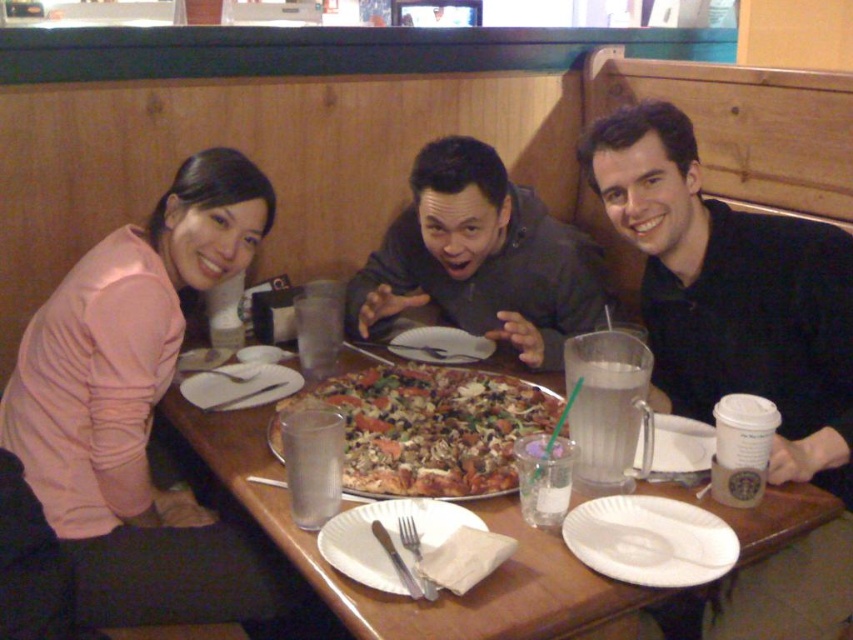
In the scene shown: Between black matte shirt at center and white paper plate at center, which one has more height?

black matte shirt at center is taller.

Who is shorter, black matte shirt at center or white paper plate at center?

white paper plate at center is shorter.

Is point (843, 344) closer to camera compared to point (421, 540)?

That is False.

Identify the location of black matte shirt at center. (741, 348).

Is pink matte sweater at left closer to the viewer compared to white paper plate at center?

That is False.

Is pink matte sweater at left shorter than white paper plate at center?

No.

The width and height of the screenshot is (853, 640). I want to click on pink matte sweater at left, so click(x=138, y=406).

Identify the location of pink matte sweater at left. This screenshot has height=640, width=853. (138, 406).

Can you confirm if brown wooden table at center is taller than crusty golden-brown pizza at center?

Correct, brown wooden table at center is much taller as crusty golden-brown pizza at center.

Between brown wooden table at center and crusty golden-brown pizza at center, which one appears on the right side from the viewer's perspective?

brown wooden table at center is more to the right.

Which is in front, point (809, 486) or point (431, 486)?

Positioned in front is point (431, 486).

This screenshot has width=853, height=640. I want to click on brown wooden table at center, so click(404, 600).